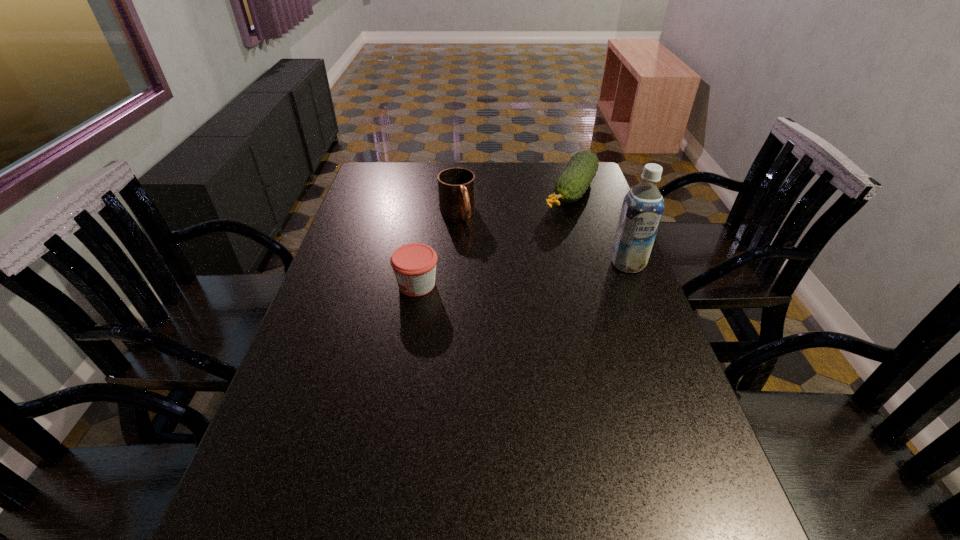
Locate an element on the screen. This screenshot has width=960, height=540. jam is located at coordinates (414, 265).

Find the location of a particular element. The width and height of the screenshot is (960, 540). soya milk is located at coordinates (643, 206).

Where is `cucumber`? cucumber is located at coordinates (572, 183).

Find the location of a particular element. This screenshot has height=540, width=960. mug is located at coordinates (456, 186).

Find the location of a particular element. The height and width of the screenshot is (540, 960). vacant position located on the front label of the jam is located at coordinates (363, 285).

Locate an element on the screen. Image resolution: width=960 pixels, height=540 pixels. free region located on the front label of the jam is located at coordinates (324, 285).

Locate an element on the screen. This screenshot has width=960, height=540. free region located 0.190m on the front label of the jam is located at coordinates (327, 285).

The width and height of the screenshot is (960, 540). Identify the location of blank space located on the label of the soya milk. (660, 346).

What are the coordinates of `free location located 0.330m at the blossom end of the cucumber` in the screenshot? It's located at (523, 269).

At what (x,y) coordinates should I click in order to perform the action: click on free location located at the blossom end of the cucumber. Please return your answer as a coordinate pair (x, y). Looking at the image, I should click on (520, 273).